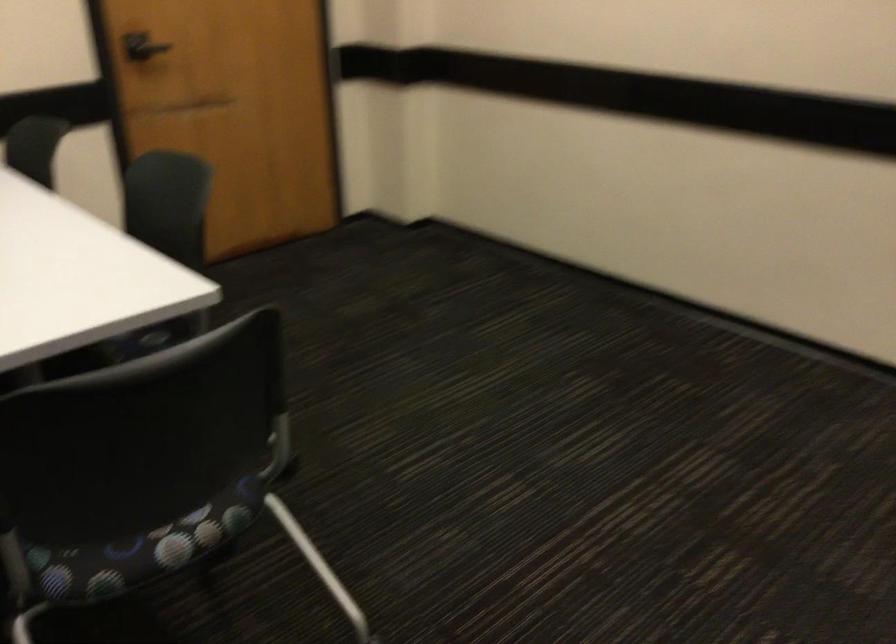
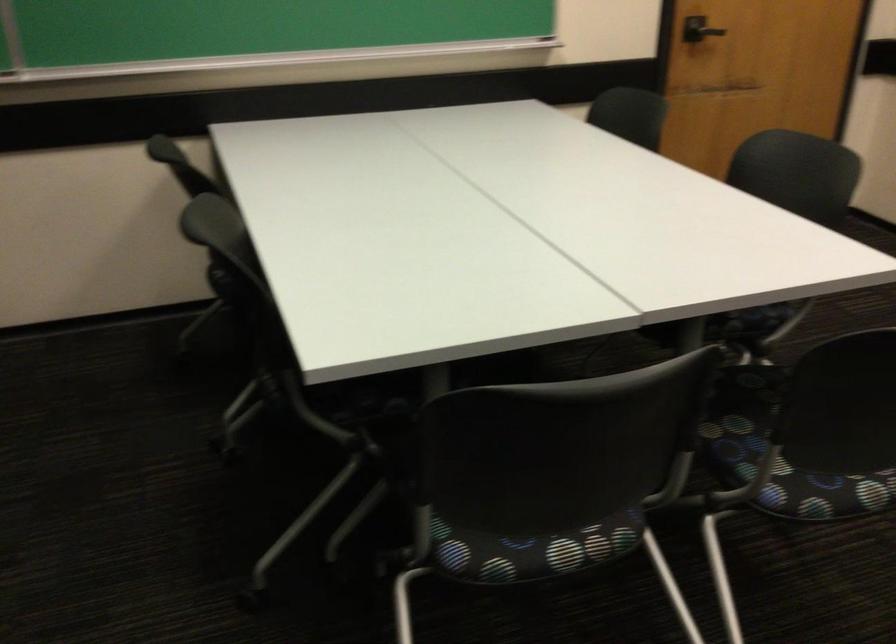
Question: The camera is either moving clockwise (left) or counter-clockwise (right) around the object. The first image is from the beginning of the video and the second image is from the end. Is the camera moving left or right when shooting the video?

Choices:
 (A) Left
 (B) Right

Answer: (B)